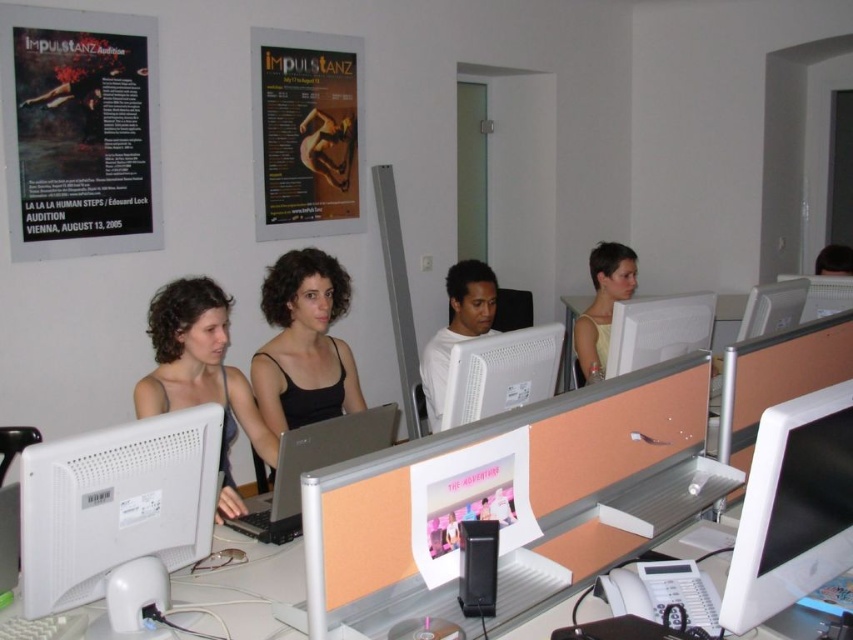
In the scene shown: Can you confirm if black paper poster at upper left is positioned to the left of white glossy monitor at center?

Yes, black paper poster at upper left is to the left of white glossy monitor at center.

Which is in front, point (16, 83) or point (627, 333)?

Positioned in front is point (627, 333).

You are a GUI agent. You are given a task and a screenshot of the screen. Output one action in this format:
    pyautogui.click(x=<x>, y=<y>)
    Task: Click on the black paper poster at upper left
    
    Given the screenshot: What is the action you would take?
    pyautogui.click(x=79, y=131)

Is the position of matte paper poster at upper center less distant than that of black matte tank top at center?

No, it is behind black matte tank top at center.

The image size is (853, 640). In order to click on matte paper poster at upper center in this screenshot , I will do `click(308, 134)`.

Locate an element on the screen. white plastic monitor at center is located at coordinates (500, 372).

Who is more forward, [483,400] or [488,282]?

Positioned in front is point [483,400].

Is point (506, 406) positioned after point (488, 292)?

No, it is in front of (488, 292).

You are a GUI agent. You are given a task and a screenshot of the screen. Output one action in this format:
    pyautogui.click(x=<x>, y=<y>)
    Task: Click on the white plastic monitor at center
    The image size is (853, 640).
    Given the screenshot: What is the action you would take?
    pyautogui.click(x=500, y=372)